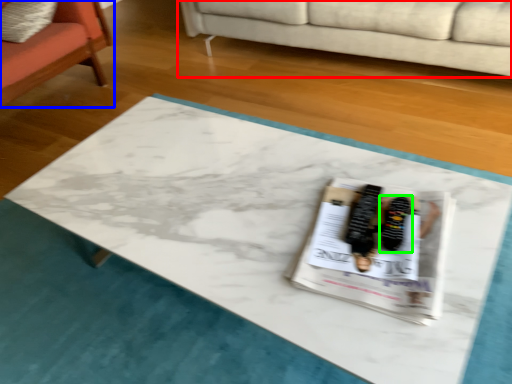
Question: Which is farther away from studio couch (highlighted by a red box)? chair (highlighted by a blue box) or footwear (highlighted by a green box)?

Choices:
 (A) chair
 (B) footwear

Answer: (B)